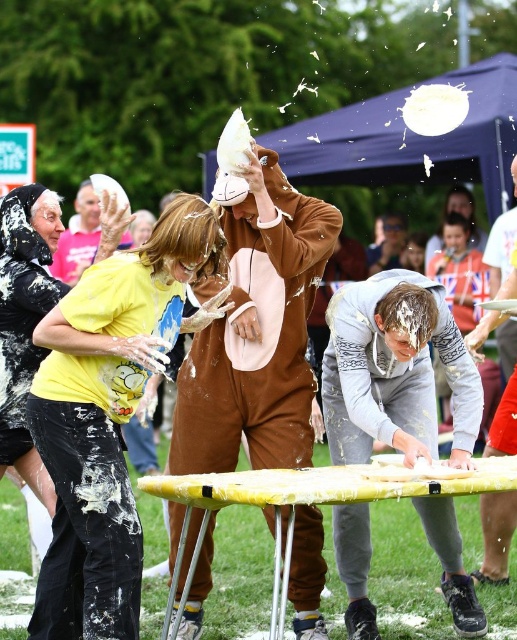
Question: Observing the image, what is the correct spatial positioning of gray fuzzy sweater at lower center in reference to yellow cotton shirt at upper left?

Choices:
 (A) right
 (B) left

Answer: (A)

Question: Does gray fuzzy sweater at lower center appear on the left side of white plastic plate at lower right?

Choices:
 (A) no
 (B) yes

Answer: (B)

Question: From the image, what is the correct spatial relationship of yellow matte shirt at center in relation to brown plush onesie at center?

Choices:
 (A) below
 (B) above

Answer: (A)

Question: Which point appears closest to the camera in this image?

Choices:
 (A) (232, 221)
 (B) (81, 237)
 (C) (372, 323)

Answer: (C)

Question: Which object appears closest to the camera in this image?

Choices:
 (A) yellow matte shirt at center
 (B) brown plush onesie at center

Answer: (A)

Question: Based on their relative distances, which object is nearer to the white plastic plate at lower right?

Choices:
 (A) gray fuzzy sweater at lower center
 (B) brown plush onesie at center
 (C) yellow matte shirt at center
 (D) yellow cotton shirt at upper left

Answer: (A)